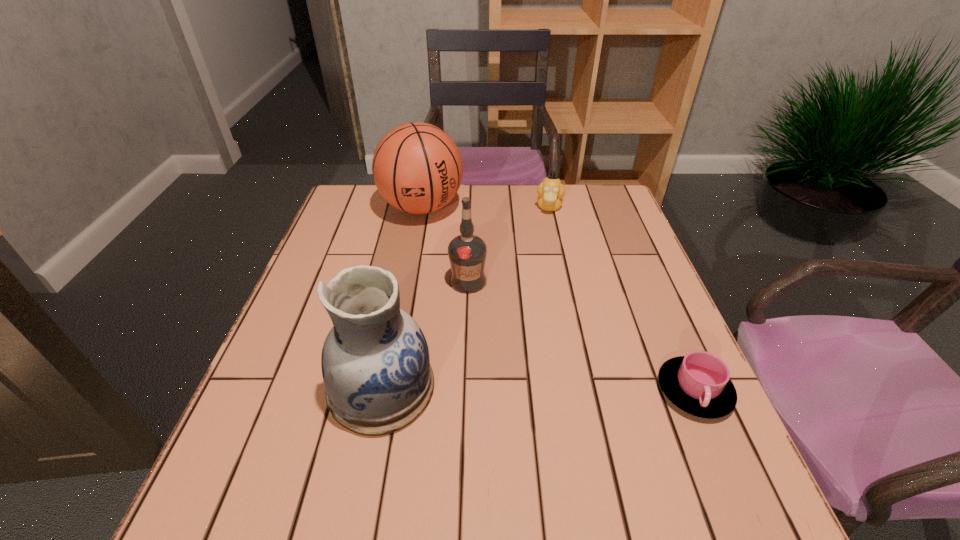
This screenshot has height=540, width=960. I want to click on vacant space at the left edge, so click(x=328, y=260).

The width and height of the screenshot is (960, 540). In the image, there is a desktop. What are the coordinates of `free space at the right edge` in the screenshot? It's located at (624, 298).

The width and height of the screenshot is (960, 540). What are the coordinates of `free region at the far left corner of the desktop` in the screenshot? It's located at (362, 214).

The height and width of the screenshot is (540, 960). Find the location of `vacant area at the near left corner`. vacant area at the near left corner is located at coordinates (253, 456).

The width and height of the screenshot is (960, 540). What are the coordinates of `free space at the far right corner` in the screenshot? It's located at (584, 194).

You are a GUI agent. You are given a task and a screenshot of the screen. Output one action in this format:
    pyautogui.click(x=<x>, y=<y>)
    Task: Click on the vacant point at the near right corner
    The width and height of the screenshot is (960, 540).
    Given the screenshot: What is the action you would take?
    pyautogui.click(x=649, y=421)

Locate an element on the screen. free space between the shortest object and the pottery is located at coordinates (538, 389).

At what (x,y) coordinates should I click in order to perform the action: click on free spot between the basketball and the pottery. Please return your answer as a coordinate pair (x, y). The width and height of the screenshot is (960, 540). Looking at the image, I should click on (401, 298).

You are a GUI agent. You are given a task and a screenshot of the screen. Output one action in this format:
    pyautogui.click(x=<x>, y=<y>)
    Task: Click on the vacant region between the basketball and the third nearest object
    
    Given the screenshot: What is the action you would take?
    point(444,244)

Identify the location of empty space that is in between the pottery and the third farthest object. (424, 334).